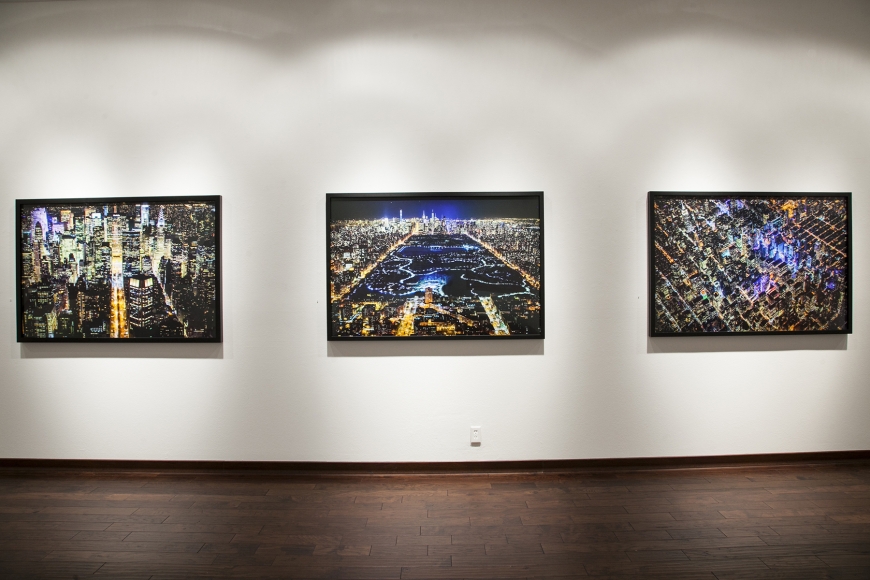
This screenshot has height=580, width=870. In order to click on wood trim in this screenshot , I will do `click(213, 462)`.